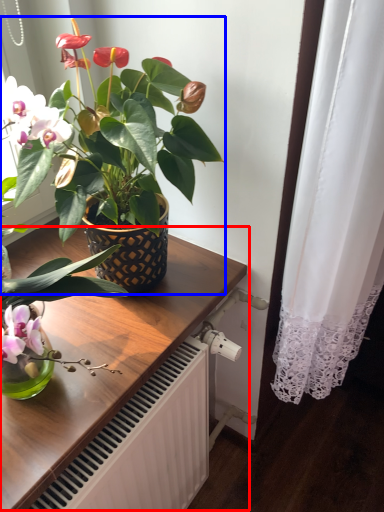
Question: Among these objects, which one is nearest to the camera, table (highlighted by a red box) or houseplant (highlighted by a blue box)?

Choices:
 (A) table
 (B) houseplant

Answer: (B)